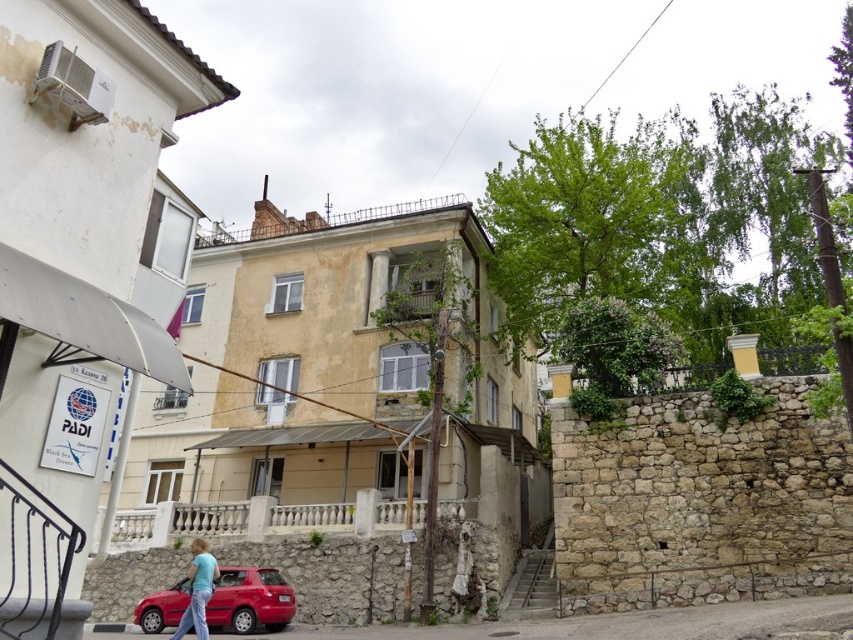
Question: Can you confirm if shiny red car at lower left is bigger than blue cotton shirt at lower center?

Choices:
 (A) no
 (B) yes

Answer: (A)

Question: Does shiny red car at lower left have a smaller size compared to blue cotton shirt at lower center?

Choices:
 (A) no
 (B) yes

Answer: (B)

Question: Among these points, which one is farthest from the camera?

Choices:
 (A) (209, 568)
 (B) (183, 582)

Answer: (B)

Question: Can you confirm if shiny red car at lower left is smaller than blue cotton shirt at lower center?

Choices:
 (A) yes
 (B) no

Answer: (A)

Question: Which of the following is the farthest from the observer?

Choices:
 (A) blue cotton shirt at lower center
 (B) shiny red car at lower left

Answer: (B)